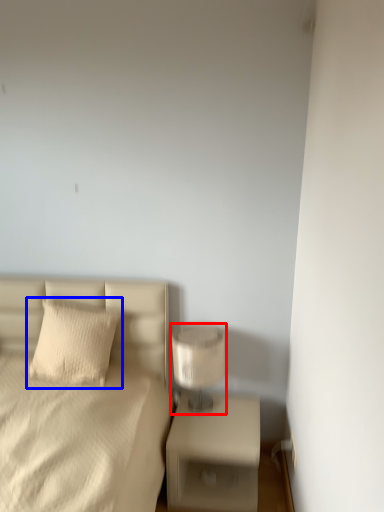
Question: Which object appears farthest to the camera in this image, table lamp (highlighted by a red box) or pillow (highlighted by a blue box)?

Choices:
 (A) table lamp
 (B) pillow

Answer: (B)